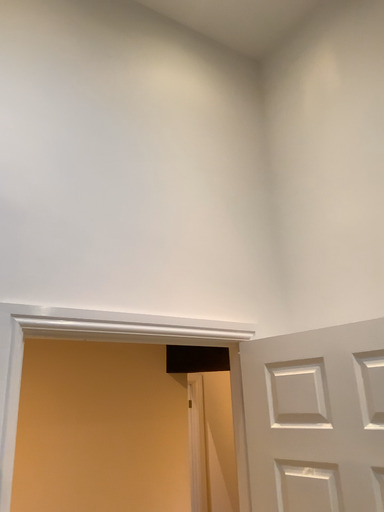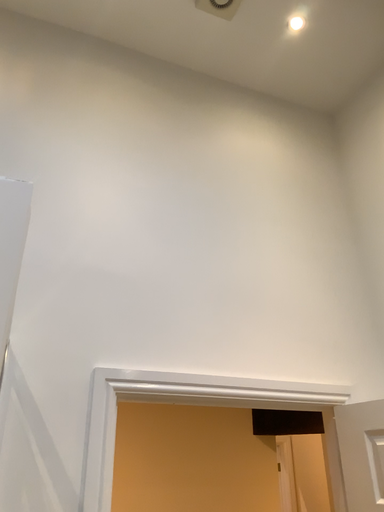
Question: Which way did the camera rotate in the video?

Choices:
 (A) rotated upward
 (B) rotated downward

Answer: (A)